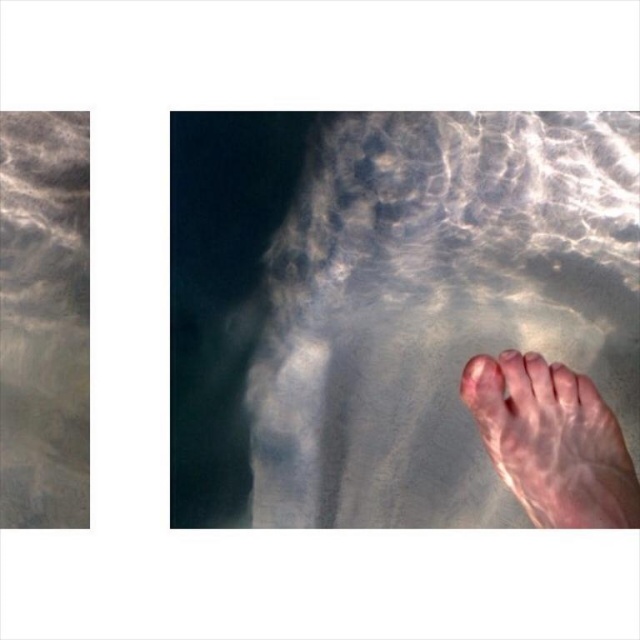
What do you see at coordinates (552, 442) in the screenshot? This screenshot has height=640, width=640. I see `pink flesh-toned foot at lower right` at bounding box center [552, 442].

This screenshot has height=640, width=640. What do you see at coordinates (552, 442) in the screenshot? I see `pink flesh-toned foot at lower right` at bounding box center [552, 442].

Where is `pink flesh-toned foot at lower right`? Image resolution: width=640 pixels, height=640 pixels. pink flesh-toned foot at lower right is located at coordinates (552, 442).